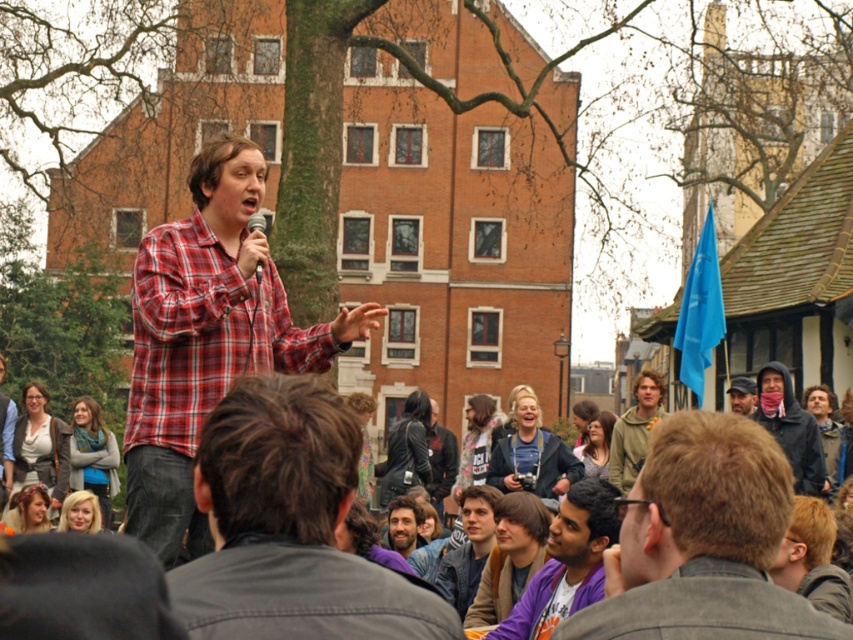
Question: Does purple fabric shirt at center come behind blue scarf at center?

Choices:
 (A) yes
 (B) no

Answer: (B)

Question: Considering the real-world distances, which object is farthest from the leather jacket at center?

Choices:
 (A) matte black cap at center
 (B) purple fabric shirt at center
 (C) blue scarf at center
 (D) plaid flannel shirt at center

Answer: (D)

Question: Does leather jacket at center appear over blonde hair at lower left?

Choices:
 (A) no
 (B) yes

Answer: (A)

Question: Which of the following is the closest to the observer?

Choices:
 (A) [392, 596]
 (B) [94, 419]
 (C) [799, 426]

Answer: (A)

Question: Among these points, which one is farthest from the camera?

Choices:
 (A) (735, 385)
 (B) (625, 433)

Answer: (B)

Question: Is purple fabric shirt at center wider than blonde hair at lower left?

Choices:
 (A) yes
 (B) no

Answer: (A)